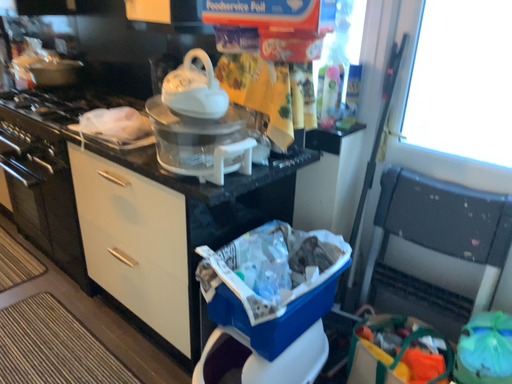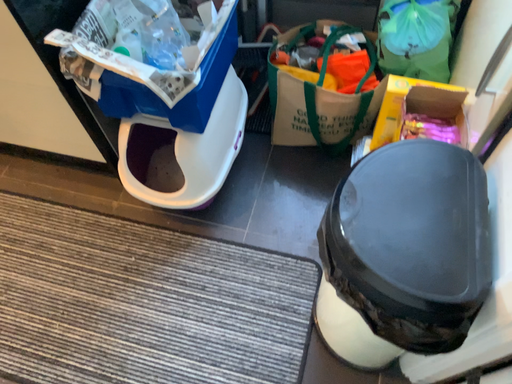
Question: Which way did the camera rotate in the video?

Choices:
 (A) rotated right
 (B) rotated left

Answer: (A)